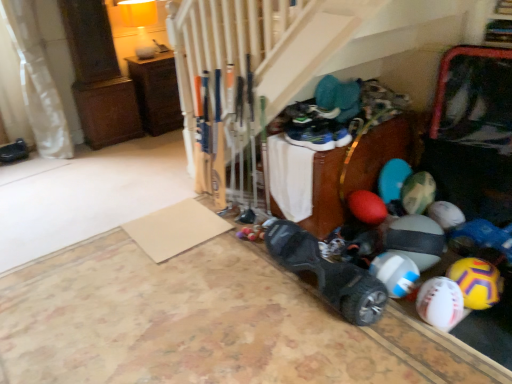
This screenshot has width=512, height=384. Describe the element at coordinates (328, 273) in the screenshot. I see `black rubber hoverboard at lower center, marked as the 1th footwear in a right-to-left arrangement` at that location.

You are a GUI agent. You are given a task and a screenshot of the screen. Output one action in this format:
    pyautogui.click(x=<x>, y=<y>)
    Task: Click on the black matte shoe at left, arranged as the 1th footwear when viewed from the left
    The image size is (512, 384).
    Given the screenshot: What is the action you would take?
    pyautogui.click(x=14, y=151)

What is the approximate width of yellow matte beach ball at lower right, which is counted as the 1th beach ball, starting from the right?

yellow matte beach ball at lower right, which is counted as the 1th beach ball, starting from the right, is 6.96 inches wide.

Where is `yellow matte beach ball at lower right, which is counted as the 1th beach ball, starting from the right`? This screenshot has width=512, height=384. yellow matte beach ball at lower right, which is counted as the 1th beach ball, starting from the right is located at coordinates pos(477,282).

The height and width of the screenshot is (384, 512). What do you see at coordinates (312, 133) in the screenshot?
I see `blue suede sneakers at center, which is the 2th footwear in right-to-left order` at bounding box center [312, 133].

How much space does white matte beach ball at lower right, which ranks as the second beach ball in left-to-right order, occupy horizontally?

It is 16.17 centimeters.

Identify the location of black rubber hoverboard at lower center, positioned as the 3th footwear in back-to-front order. (328, 273).

Which object is positioned more to the left, brown wood cabinet at upper left or white matte beach ball at lower right, which is the second beach ball from right to left?

From the viewer's perspective, brown wood cabinet at upper left appears more on the left side.

Considering the positions of points (172, 125) and (437, 299), is point (172, 125) closer to camera compared to point (437, 299)?

No, (172, 125) is behind (437, 299).

From a real-world perspective, is brown wood cabinet at upper left positioned over white matte beach ball at lower right, which ranks as the second beach ball in left-to-right order, based on gravity?

Yes, from a real-world perspective, brown wood cabinet at upper left is above white matte beach ball at lower right, which ranks as the second beach ball in left-to-right order.

How much distance is there between brown wood cabinet at upper left and white matte beach ball at lower right, which is the second beach ball from right to left?

brown wood cabinet at upper left and white matte beach ball at lower right, which is the second beach ball from right to left, are 3.05 meters apart.

Is yellow matte beach ball at lower right, which is counted as the 1th beach ball, starting from the right, positioned beyond the bounds of blue rubber beach ball at lower right, placed as the third beach ball when sorted from right to left?

Yes, yellow matte beach ball at lower right, which is counted as the 1th beach ball, starting from the right, is located beyond the bounds of blue rubber beach ball at lower right, placed as the third beach ball when sorted from right to left.

Based on the photo, is yellow matte beach ball at lower right, which is counted as the 1th beach ball, starting from the right, not near blue rubber beach ball at lower right, placed as the third beach ball when sorted from right to left?

Actually, yellow matte beach ball at lower right, which is counted as the 1th beach ball, starting from the right, and blue rubber beach ball at lower right, placed as the third beach ball when sorted from right to left, are a little close together.

From the image's perspective, relative to blue rubber beach ball at lower right, placed as the third beach ball when sorted from right to left, is yellow matte beach ball at lower right, the 3th beach ball in the left-to-right sequence, above or below?

Clearly, from the image's perspective, yellow matte beach ball at lower right, the 3th beach ball in the left-to-right sequence, is below blue rubber beach ball at lower right, placed as the third beach ball when sorted from right to left.

Can you tell me how much yellow matte beach ball at lower right, the 3th beach ball in the left-to-right sequence, and blue rubber beach ball at lower right, which is the 1th beach ball from left to right, differ in facing direction?

0.00165 degrees.

Is the surface of white matte beach ball at lower right, which ranks as the second beach ball in left-to-right order, in direct contact with black rubber hoverboard at lower center, positioned as the 3th footwear in back-to-front order?

No, white matte beach ball at lower right, which ranks as the second beach ball in left-to-right order, is not making contact with black rubber hoverboard at lower center, positioned as the 3th footwear in back-to-front order.

This screenshot has height=384, width=512. I want to click on beach ball that is the 3rd object located below the black rubber hoverboard at lower center, acting as the first footwear starting from the bottom (from the image's perspective), so tap(440, 303).

Is point (461, 315) farther from camera compared to point (266, 229)?

No, (461, 315) is closer to viewer.

Can you tell me how much yellow matte beach ball at lower right, the 3th beach ball in the left-to-right sequence, and white matte beach ball at lower right, which is the second beach ball from right to left, differ in facing direction?

The angle between the facing direction of yellow matte beach ball at lower right, the 3th beach ball in the left-to-right sequence, and the facing direction of white matte beach ball at lower right, which is the second beach ball from right to left, is 0.000798 degrees.

Is yellow matte beach ball at lower right, which is counted as the 1th beach ball, starting from the right, oriented away from white matte beach ball at lower right, which ranks as the second beach ball in left-to-right order?

That's not correct — yellow matte beach ball at lower right, which is counted as the 1th beach ball, starting from the right, is not looking away from white matte beach ball at lower right, which ranks as the second beach ball in left-to-right order.

From a real-world perspective, starting from the yellow matte beach ball at lower right, the 3th beach ball in the left-to-right sequence, which beach ball is the 1st one below it? Please provide its 2D coordinates.

[(440, 303)]

Is yellow matte beach ball at lower right, which is counted as the 1th beach ball, starting from the right, behind white matte beach ball at lower right, which ranks as the second beach ball in left-to-right order?

Yes.

Which is more to the left, white fabric curtain at left or black rubber hoverboard at lower center, the first footwear in the front-to-back sequence?

white fabric curtain at left is more to the left.

Locate an element on the screen. The height and width of the screenshot is (384, 512). curtain above the black rubber hoverboard at lower center, positioned as the 3th footwear in back-to-front order (from a real-world perspective) is located at coordinates (30, 85).

Does white fabric curtain at left have a larger size compared to black rubber hoverboard at lower center, positioned as the 3th footwear in back-to-front order?

Yes, white fabric curtain at left is bigger than black rubber hoverboard at lower center, positioned as the 3th footwear in back-to-front order.

Is blue rubber beach ball at lower right, placed as the third beach ball when sorted from right to left, facing away from white fabric curtain at left?

No, blue rubber beach ball at lower right, placed as the third beach ball when sorted from right to left, is not facing away from white fabric curtain at left.

From the image's perspective, is blue rubber beach ball at lower right, placed as the third beach ball when sorted from right to left, below white fabric curtain at left?

Indeed, from the image's perspective, blue rubber beach ball at lower right, placed as the third beach ball when sorted from right to left, is shown beneath white fabric curtain at left.

Is white fabric curtain at left located within blue rubber beach ball at lower right, placed as the third beach ball when sorted from right to left?

Actually, white fabric curtain at left is outside blue rubber beach ball at lower right, placed as the third beach ball when sorted from right to left.

Is yellow matte beach ball at lower right, which is counted as the 1th beach ball, starting from the right, wider or thinner than blue suede sneakers at center, the second footwear in the left-to-right sequence?

yellow matte beach ball at lower right, which is counted as the 1th beach ball, starting from the right, is wider than blue suede sneakers at center, the second footwear in the left-to-right sequence.

Does yellow matte beach ball at lower right, the 3th beach ball in the left-to-right sequence, come behind blue suede sneakers at center, which is counted as the second footwear, starting from the top?

No, yellow matte beach ball at lower right, the 3th beach ball in the left-to-right sequence, is in front of blue suede sneakers at center, which is counted as the second footwear, starting from the top.

Which point is more forward, (484, 298) or (322, 128)?

The point (484, 298) is in front.

Where is `furniture positioned vertically above the white matte beach ball at lower right, which ranks as the second beach ball in left-to-right order (from a real-world perspective)`? furniture positioned vertically above the white matte beach ball at lower right, which ranks as the second beach ball in left-to-right order (from a real-world perspective) is located at coordinates (156, 92).

At what (x,y) coordinates should I click in order to perform the action: click on beach ball that is the 1st object located in front of the blue rubber beach ball at lower right, which is the 1th beach ball from left to right. Please return your answer as a coordinate pair (x, y). The image size is (512, 384). Looking at the image, I should click on (477, 282).

Estimate the real-world distances between objects in this image. Which object is closer to black rubber hoverboard at lower center, the third footwear in the left-to-right sequence, blue suede sneakers at center, which is the 2th footwear in right-to-left order, or yellow matte beach ball at lower right, which is counted as the 1th beach ball, starting from the right?

Based on the image, yellow matte beach ball at lower right, which is counted as the 1th beach ball, starting from the right, appears to be nearer to black rubber hoverboard at lower center, the third footwear in the left-to-right sequence.

Based on their spatial positions, is blue suede sneakers at center, the second footwear in the left-to-right sequence, or black matte shoe at left, arranged as the 1th footwear when viewed from the left, closer to blue rubber beach ball at lower right, which is the 1th beach ball from left to right?

Among the two, blue suede sneakers at center, the second footwear in the left-to-right sequence, is located nearer to blue rubber beach ball at lower right, which is the 1th beach ball from left to right.

Based on their spatial positions, is white matte beach ball at lower right, which ranks as the second beach ball in left-to-right order, or black matte shoe at left, arranged as the 1th footwear when viewed from the left, closer to brown wood cabinet at upper left?

black matte shoe at left, arranged as the 1th footwear when viewed from the left, is positioned closer to the anchor brown wood cabinet at upper left.

Estimate the real-world distances between objects in this image. Which object is further from black rubber hoverboard at lower center, positioned as the 3th footwear in back-to-front order, yellow matte beach ball at lower right, which is counted as the 1th beach ball, starting from the right, or brown wood cabinet at upper left?

The object further to black rubber hoverboard at lower center, positioned as the 3th footwear in back-to-front order, is brown wood cabinet at upper left.

Looking at the image, which one is located further to black matte shoe at left, marked as the 3th footwear in a front-to-back arrangement, black rubber hoverboard at lower center, the first footwear in the front-to-back sequence, or white matte beach ball at lower right, which ranks as the second beach ball in left-to-right order?

The object further to black matte shoe at left, marked as the 3th footwear in a front-to-back arrangement, is white matte beach ball at lower right, which ranks as the second beach ball in left-to-right order.

From the image, which object appears to be nearer to brown wood cabinet at upper left, white fabric curtain at left or blue rubber beach ball at lower right, which is the 1th beach ball from left to right?

Among the two, white fabric curtain at left is located nearer to brown wood cabinet at upper left.

Estimate the real-world distances between objects in this image. Which object is closer to black matte shoe at left, acting as the first footwear starting from the back, yellow matte beach ball at lower right, which is counted as the 1th beach ball, starting from the right, or white fabric curtain at left?

white fabric curtain at left lies closer to black matte shoe at left, acting as the first footwear starting from the back, than the other object.

Considering their positions, is brown wood cabinet at upper left positioned closer to yellow matte beach ball at lower right, the 3th beach ball in the left-to-right sequence, than black rubber hoverboard at lower center, the third footwear in the left-to-right sequence?

black rubber hoverboard at lower center, the third footwear in the left-to-right sequence, is positioned closer to the anchor yellow matte beach ball at lower right, the 3th beach ball in the left-to-right sequence.

What are the coordinates of `beach ball that lies between blue suede sneakers at center, the second footwear in the left-to-right sequence, and yellow matte beach ball at lower right, the 3th beach ball in the left-to-right sequence, from top to bottom` in the screenshot? It's located at (395, 273).

Locate an element on the screen. curtain between black matte shoe at left, marked as the 3th footwear in a front-to-back arrangement, and blue rubber beach ball at lower right, which is the 1th beach ball from left to right is located at coordinates (30, 85).

Identify the location of footwear between blue suede sneakers at center, the second footwear in the left-to-right sequence, and yellow matte beach ball at lower right, which is counted as the 1th beach ball, starting from the right, vertically. This screenshot has height=384, width=512. (328, 273).

The image size is (512, 384). I want to click on beach ball located between yellow matte beach ball at lower right, the 3th beach ball in the left-to-right sequence, and brown wood cabinet at upper left in the depth direction, so click(395, 273).